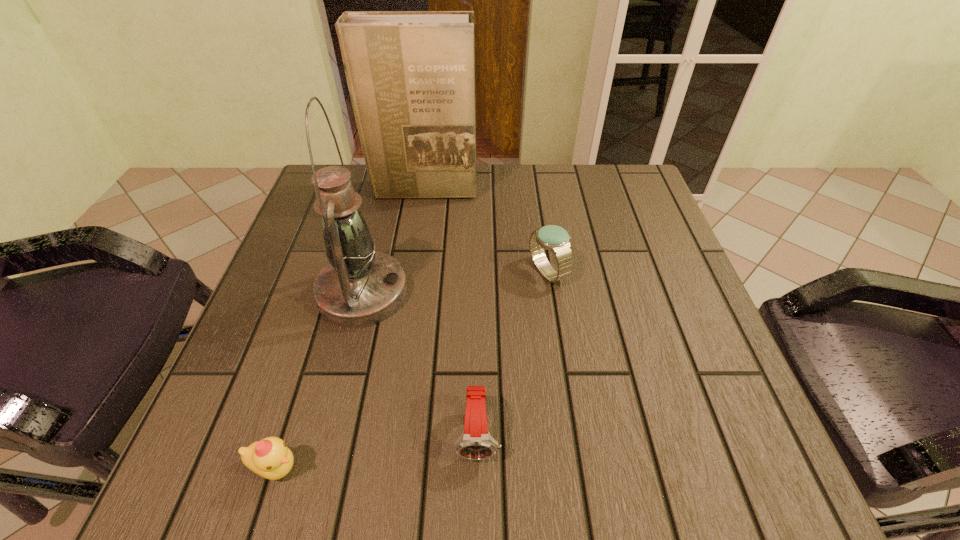
I want to click on vacant space that satisfies the following two spatial constraints: 1. on the cover of the phonebook; 2. on the front-facing side of the duckling, so click(382, 468).

Where is `free point that satisfies the following two spatial constraints: 1. on the cover of the phonebook; 2. on the right side of the right watch`? The width and height of the screenshot is (960, 540). free point that satisfies the following two spatial constraints: 1. on the cover of the phonebook; 2. on the right side of the right watch is located at coordinates (412, 272).

The image size is (960, 540). I want to click on vacant space that satisfies the following two spatial constraints: 1. on the face of the left watch; 2. on the front-facing side of the duckling, so click(478, 468).

The image size is (960, 540). I want to click on free space that satisfies the following two spatial constraints: 1. on the cover of the phonebook; 2. on the left side of the rightmost object, so click(412, 272).

The image size is (960, 540). I want to click on vacant space that satisfies the following two spatial constraints: 1. on the face of the left watch; 2. on the front-facing side of the duckling, so click(478, 468).

Where is `vacant space that satisfies the following two spatial constraints: 1. on the face of the nearer watch; 2. on the front-facing side of the duckling`? This screenshot has width=960, height=540. vacant space that satisfies the following two spatial constraints: 1. on the face of the nearer watch; 2. on the front-facing side of the duckling is located at coordinates (478, 468).